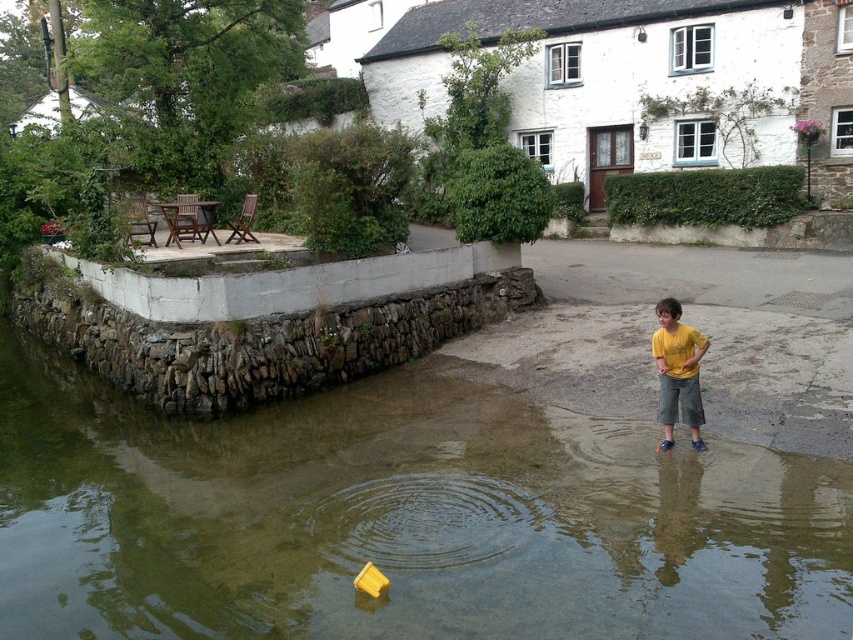
Question: Which point is farther from the camera taking this photo?

Choices:
 (A) (525, 332)
 (B) (109, 609)
 (C) (659, 380)

Answer: (A)

Question: Estimate the real-world distances between objects in this image. Which object is closer to the yellow fabric at lower right?

Choices:
 (A) yellow cotton shirt at lower right
 (B) greenish water at lower left

Answer: (A)

Question: Is greenish water at lower left thinner than yellow fabric at lower right?

Choices:
 (A) yes
 (B) no

Answer: (B)

Question: Does greenish water at lower left have a larger size compared to yellow fabric at lower right?

Choices:
 (A) no
 (B) yes

Answer: (B)

Question: Does yellow fabric at lower right have a larger size compared to yellow cotton shirt at lower right?

Choices:
 (A) yes
 (B) no

Answer: (B)

Question: Which object appears closest to the camera in this image?

Choices:
 (A) yellow cotton shirt at lower right
 (B) greenish water at lower left

Answer: (B)